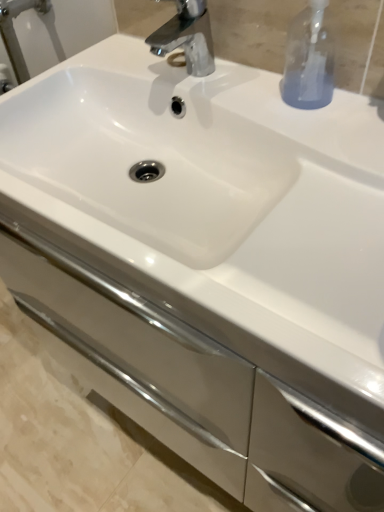
Question: Is polished chrome faucet at upper center further to the viewer compared to white glossy cabinet at center?

Choices:
 (A) no
 (B) yes

Answer: (B)

Question: Considering the relative sizes of polished chrome faucet at upper center and white glossy cabinet at center in the image provided, is polished chrome faucet at upper center shorter than white glossy cabinet at center?

Choices:
 (A) yes
 (B) no

Answer: (A)

Question: Considering the relative sizes of polished chrome faucet at upper center and white glossy cabinet at center in the image provided, is polished chrome faucet at upper center wider than white glossy cabinet at center?

Choices:
 (A) no
 (B) yes

Answer: (A)

Question: Could you tell me if polished chrome faucet at upper center is facing white glossy cabinet at center?

Choices:
 (A) yes
 (B) no

Answer: (B)

Question: Is white glossy cabinet at center at the back of polished chrome faucet at upper center?

Choices:
 (A) no
 (B) yes

Answer: (A)

Question: Is white glossy cabinet at center bigger or smaller than polished chrome faucet at upper center?

Choices:
 (A) big
 (B) small

Answer: (A)

Question: Is white glossy cabinet at center spatially inside polished chrome faucet at upper center, or outside of it?

Choices:
 (A) inside
 (B) outside

Answer: (B)

Question: From a real-world perspective, relative to polished chrome faucet at upper center, is white glossy cabinet at center vertically above or below?

Choices:
 (A) below
 (B) above

Answer: (A)

Question: Is white glossy cabinet at center to the left or to the right of polished chrome faucet at upper center in the image?

Choices:
 (A) left
 (B) right

Answer: (B)

Question: Relative to white glossy cabinet at center, is polished chrome faucet at upper center in front or behind?

Choices:
 (A) behind
 (B) front

Answer: (A)

Question: From their relative heights in the image, would you say polished chrome faucet at upper center is taller or shorter than white glossy cabinet at center?

Choices:
 (A) tall
 (B) short

Answer: (B)

Question: From the image's perspective, is polished chrome faucet at upper center positioned above or below white glossy cabinet at center?

Choices:
 (A) above
 (B) below

Answer: (A)

Question: Is point (200, 60) closer or farther from the camera than point (367, 437)?

Choices:
 (A) farther
 (B) closer

Answer: (A)

Question: From a real-world perspective, is transparent glass soap dispenser at upper right positioned above or below polished chrome faucet at upper center?

Choices:
 (A) above
 (B) below

Answer: (A)

Question: Does point (317, 96) appear closer or farther from the camera than point (188, 72)?

Choices:
 (A) closer
 (B) farther

Answer: (A)